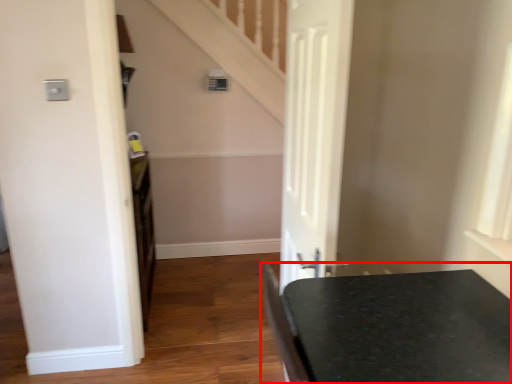
Question: From the image's perspective, where is table (annotated by the red box) located in relation to door in the image?

Choices:
 (A) above
 (B) below

Answer: (B)